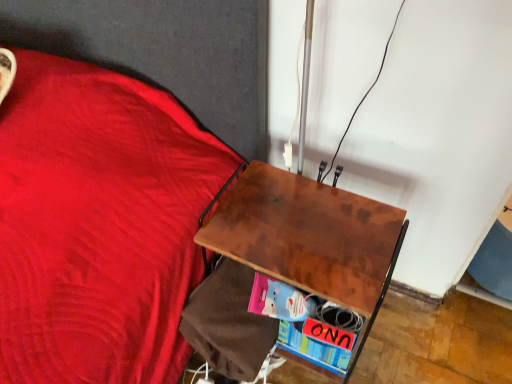
Question: Based on their sizes in the image, would you say multicolored cardboard book at lower right is bigger or smaller than brown wood desk at center?

Choices:
 (A) small
 (B) big

Answer: (A)

Question: Is point (325, 355) positioned closer to the camera than point (352, 254)?

Choices:
 (A) closer
 (B) farther

Answer: (B)

Question: Looking at their shapes, would you say multicolored cardboard book at lower right is wider or thinner than brown wood desk at center?

Choices:
 (A) thin
 (B) wide

Answer: (A)

Question: Considering the positions of brown wood desk at center and multicolored cardboard book at lower right in the image, is brown wood desk at center taller or shorter than multicolored cardboard book at lower right?

Choices:
 (A) tall
 (B) short

Answer: (A)

Question: In terms of size, does brown wood desk at center appear bigger or smaller than multicolored cardboard book at lower right?

Choices:
 (A) small
 (B) big

Answer: (B)

Question: Considering the positions of brown wood desk at center and multicolored cardboard book at lower right in the image, is brown wood desk at center wider or thinner than multicolored cardboard book at lower right?

Choices:
 (A) wide
 (B) thin

Answer: (A)

Question: Does point (357, 240) appear closer or farther from the camera than point (340, 357)?

Choices:
 (A) closer
 (B) farther

Answer: (A)